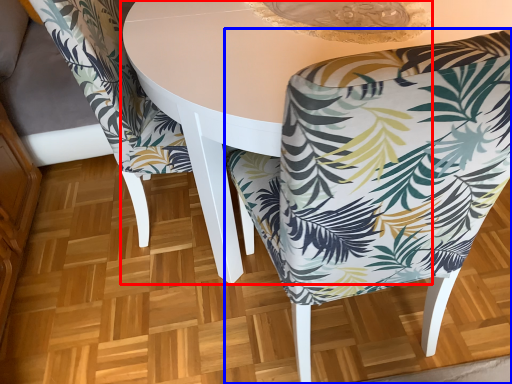
Question: Which object is closer to the camera taking this photo, round table (highlighted by a red box) or chair (highlighted by a blue box)?

Choices:
 (A) round table
 (B) chair

Answer: (B)